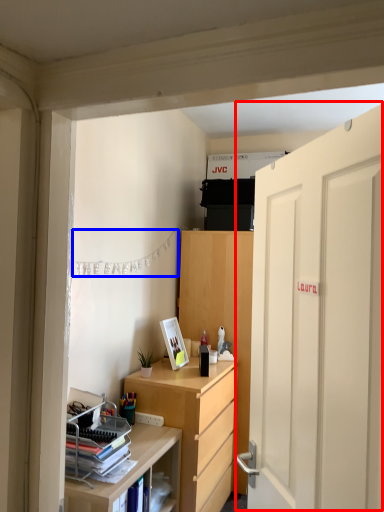
Question: Which object is further to the camera taking this photo, door (highlighted by a red box) or clothesline (highlighted by a blue box)?

Choices:
 (A) door
 (B) clothesline

Answer: (B)